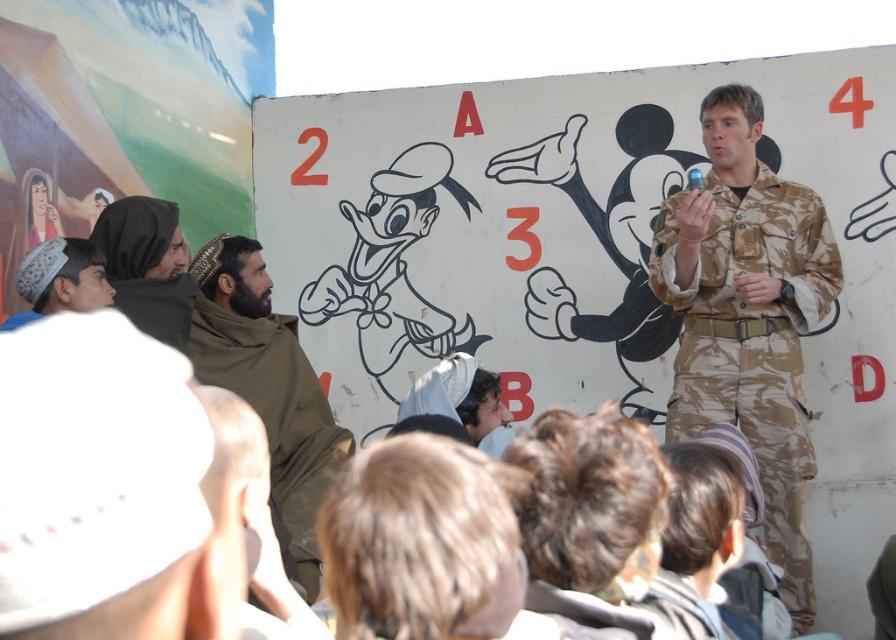
In the scene shown: Who is more distant from viewer, (791, 552) or (96, 284)?

The point (791, 552) is more distant.

Is camouflage uniform at center below light brown fabric cap at left?

Yes, camouflage uniform at center is below light brown fabric cap at left.

You are a GUI agent. You are given a task and a screenshot of the screen. Output one action in this format:
    pyautogui.click(x=<x>, y=<y>)
    Task: Click on the camouflage uniform at center
    The height and width of the screenshot is (640, 896).
    Given the screenshot: What is the action you would take?
    pyautogui.click(x=748, y=316)

Does point (722, 365) lie behind point (140, 257)?

Yes, point (722, 365) is behind point (140, 257).

Where is `camouflage uniform at center`? The height and width of the screenshot is (640, 896). camouflage uniform at center is located at coordinates (748, 316).

Does point (815, 269) lie behind point (256, 250)?

No, (815, 269) is in front of (256, 250).

Between camouflage uniform at center and brown woolen scarf at left, which one has more height?

camouflage uniform at center is taller.

This screenshot has width=896, height=640. I want to click on camouflage uniform at center, so click(x=748, y=316).

Locate an element on the screen. This screenshot has height=640, width=896. camouflage uniform at center is located at coordinates (748, 316).